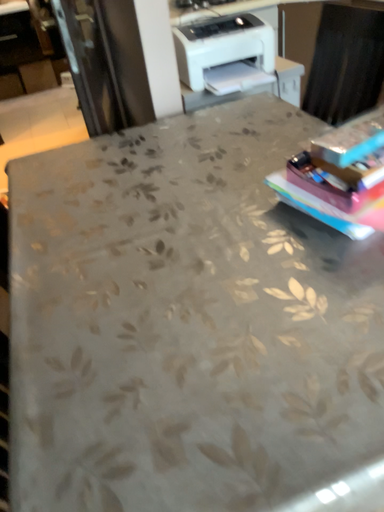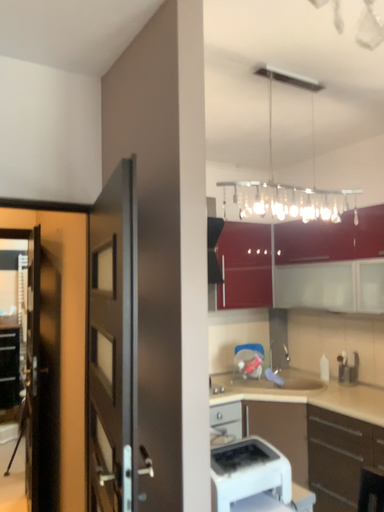
Question: Which way did the camera rotate in the video?

Choices:
 (A) rotated right
 (B) rotated left

Answer: (A)